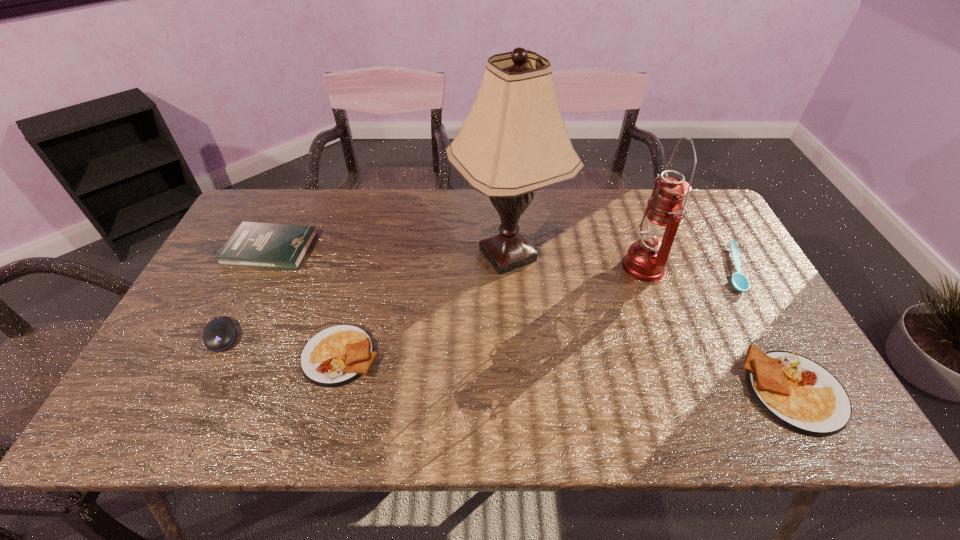
Locate an element on the screen. This screenshot has height=540, width=960. the shorter omelet is located at coordinates (337, 355).

The width and height of the screenshot is (960, 540). In order to click on the third object from left to right in this screenshot , I will do `click(337, 355)`.

Where is `the right omelet`? Image resolution: width=960 pixels, height=540 pixels. the right omelet is located at coordinates (796, 392).

At what (x,y) coordinates should I click in order to perform the action: click on the fourth object from left to right. Please return your answer as a coordinate pair (x, y). Image resolution: width=960 pixels, height=540 pixels. Looking at the image, I should click on (513, 142).

Where is `the tallest object`? the tallest object is located at coordinates (513, 142).

In order to click on book in this screenshot , I will do `click(262, 245)`.

The image size is (960, 540). I want to click on the shortest object, so click(740, 282).

Find the location of a particular element. oil lamp is located at coordinates (646, 260).

Locate an element on the screen. The image size is (960, 540). the fifth object from left to right is located at coordinates (646, 260).

You are a GUI agent. You are given a task and a screenshot of the screen. Output one action in this format:
    pyautogui.click(x=<x>, y=<y>)
    Task: Click on the computer mouse
    
    Given the screenshot: What is the action you would take?
    pyautogui.click(x=219, y=333)